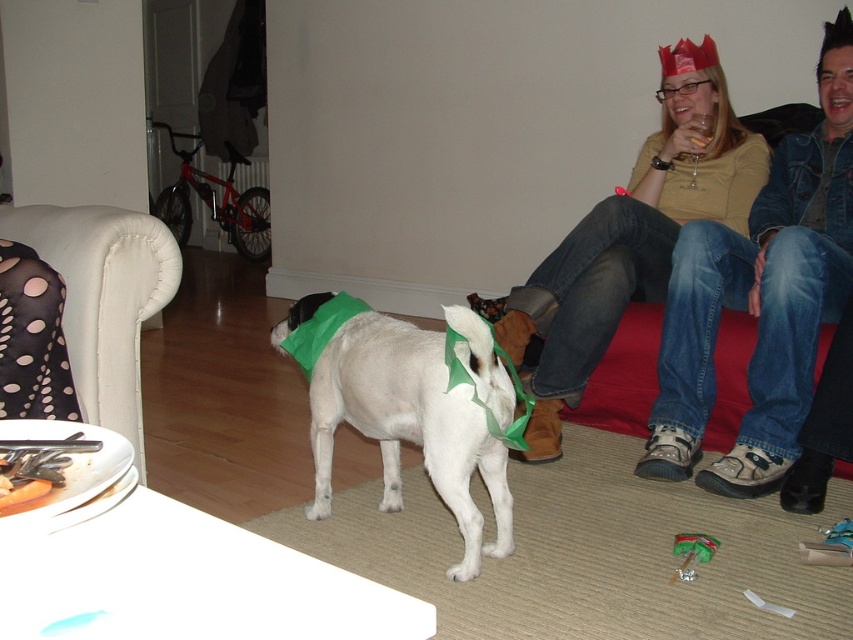
You are a guest at a party and want to sit down. You see the denim jacket at upper right and the white fabric armchair at left. Which object is higher up in the image?

The denim jacket at upper right is located above the white fabric armchair at left, so it is higher up in the image.

You are a guest at this festive gathering and need to sit down. Which object would you choose between the white fabric armchair at left and the black dotted fabric dress at left, and why?

You should choose the white fabric armchair at left because it is taller than the black dotted fabric dress at left, making it more suitable for sitting.